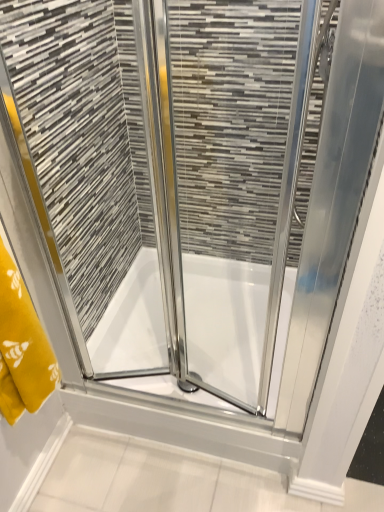
Where is `yellow fabric towel at left`? yellow fabric towel at left is located at coordinates (22, 347).

The width and height of the screenshot is (384, 512). What do you see at coordinates (22, 347) in the screenshot?
I see `yellow fabric towel at left` at bounding box center [22, 347].

The height and width of the screenshot is (512, 384). What do you see at coordinates (226, 321) in the screenshot?
I see `white glossy bath at center` at bounding box center [226, 321].

What are the coordinates of `white glossy bath at center` in the screenshot? It's located at (226, 321).

At what (x,y) coordinates should I click in order to perform the action: click on yellow fabric towel at left. Please return your answer as a coordinate pair (x, y). Image resolution: width=384 pixels, height=512 pixels. Looking at the image, I should click on (22, 347).

Considering the relative positions of white glossy bath at center and yellow fabric towel at left in the image provided, is white glossy bath at center to the left or to the right of yellow fabric towel at left?

white glossy bath at center is positioned on yellow fabric towel at left's right side.

Relative to yellow fabric towel at left, is white glossy bath at center in front or behind?

Visually, white glossy bath at center is located behind yellow fabric towel at left.

Does point (114, 361) appear closer or farther from the camera than point (37, 318)?

Point (114, 361) is farther from the camera than point (37, 318).

From the image's perspective, between white glossy bath at center and yellow fabric towel at left, who is located below?

white glossy bath at center.

From a real-world perspective, is white glossy bath at center on top of yellow fabric towel at left?

No, from a real-world perspective, white glossy bath at center is not above yellow fabric towel at left.

Can you confirm if white glossy bath at center is thinner than yellow fabric towel at left?

No, white glossy bath at center is not thinner than yellow fabric towel at left.

Is white glossy bath at center shorter than yellow fabric towel at left?

Indeed, white glossy bath at center has a lesser height compared to yellow fabric towel at left.

Based on their sizes in the image, would you say white glossy bath at center is bigger or smaller than yellow fabric towel at left?

Considering their sizes, white glossy bath at center takes up more space than yellow fabric towel at left.

Based on the photo, which is correct: white glossy bath at center is inside yellow fabric towel at left, or outside of it?

white glossy bath at center exists outside the volume of yellow fabric towel at left.

Is white glossy bath at center in contact with yellow fabric towel at left?

They are not placed beside each other.

Is white glossy bath at center looking in the opposite direction of yellow fabric towel at left?

white glossy bath at center does not have its back to yellow fabric towel at left.

Locate an element on the screen. The height and width of the screenshot is (512, 384). bath towel on the left of white glossy bath at center is located at coordinates (22, 347).

Which is more to the right, yellow fabric towel at left or white glossy bath at center?

white glossy bath at center is more to the right.

Is yellow fabric towel at left in front of or behind white glossy bath at center in the image?

In the image, yellow fabric towel at left appears in front of white glossy bath at center.

Is point (23, 393) closer or farther from the camera than point (115, 352)?

Point (23, 393) is positioned closer to the camera compared to point (115, 352).

From the image's perspective, is yellow fabric towel at left located above or below white glossy bath at center?

From the image's perspective, yellow fabric towel at left appears above white glossy bath at center.

From a real-world perspective, between yellow fabric towel at left and white glossy bath at center, who is vertically higher?

In real-world perspective, yellow fabric towel at left is above.

Between yellow fabric towel at left and white glossy bath at center, which one has smaller width?

yellow fabric towel at left is thinner.

Does yellow fabric towel at left have a greater height compared to white glossy bath at center?

Correct, yellow fabric towel at left is much taller as white glossy bath at center.

Which of these two, yellow fabric towel at left or white glossy bath at center, is smaller?

yellow fabric towel at left.

Is white glossy bath at center a part of yellow fabric towel at left?

Actually, white glossy bath at center is outside yellow fabric towel at left.

Is yellow fabric towel at left next to white glossy bath at center?

No, yellow fabric towel at left is not touching white glossy bath at center.

Is yellow fabric towel at left facing towards white glossy bath at center?

No, yellow fabric towel at left is not oriented towards white glossy bath at center.

Where is `bath towel on the left of white glossy bath at center`? bath towel on the left of white glossy bath at center is located at coordinates (22, 347).

Locate an element on the screen. bath towel above the white glossy bath at center (from a real-world perspective) is located at coordinates (22, 347).

In the image, there is a white glossy bath at center. Find the location of `bath towel above it (from the image's perspective)`. bath towel above it (from the image's perspective) is located at coordinates (22, 347).